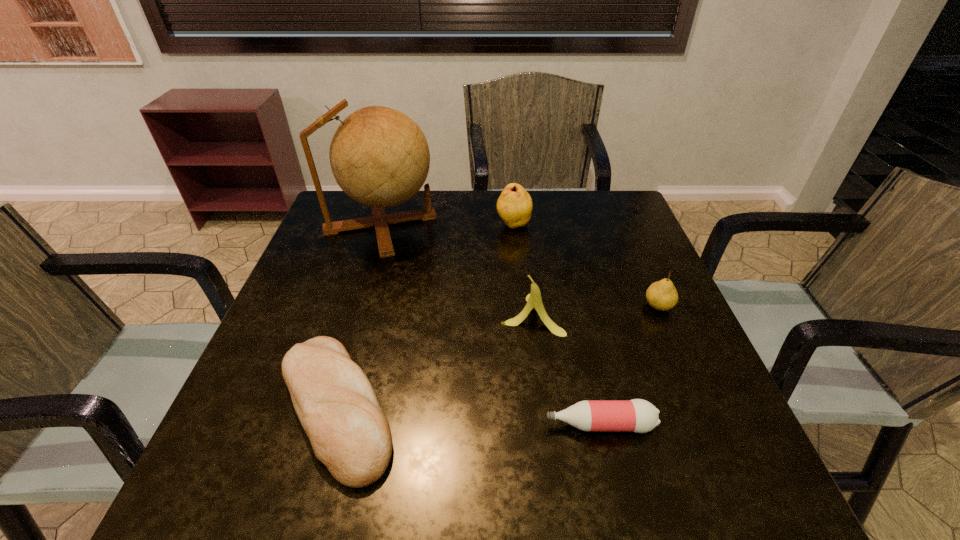
Choose which object is the third nearest neighbor to the shortest object. Please provide its 2D coordinates. Your answer should be formatted as a tuple, i.e. [(x, y)], where the tuple contains the x and y coordinates of a point satisfying the conditions above.

[(335, 402)]

I want to click on object that is the fourth closest to the bottle, so click(x=379, y=156).

Where is `vacant area in the image that satisfies the following two spatial constraints: 1. on the front side of the fifth shortest object; 2. on the right side of the banana`? vacant area in the image that satisfies the following two spatial constraints: 1. on the front side of the fifth shortest object; 2. on the right side of the banana is located at coordinates (522, 314).

Locate an element on the screen. vacant area that satisfies the following two spatial constraints: 1. on the surface of the shorter pear; 2. on the right side of the tallest object is located at coordinates (356, 306).